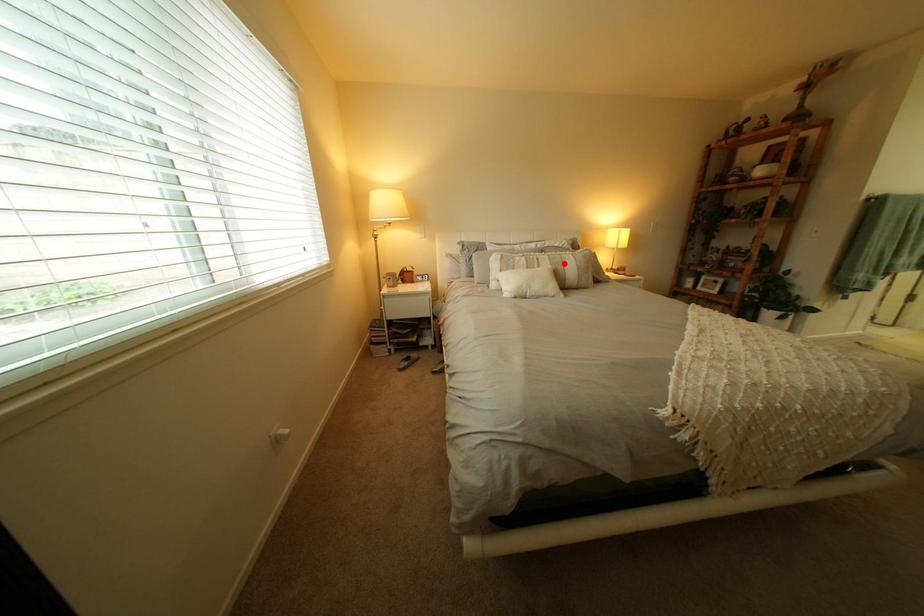
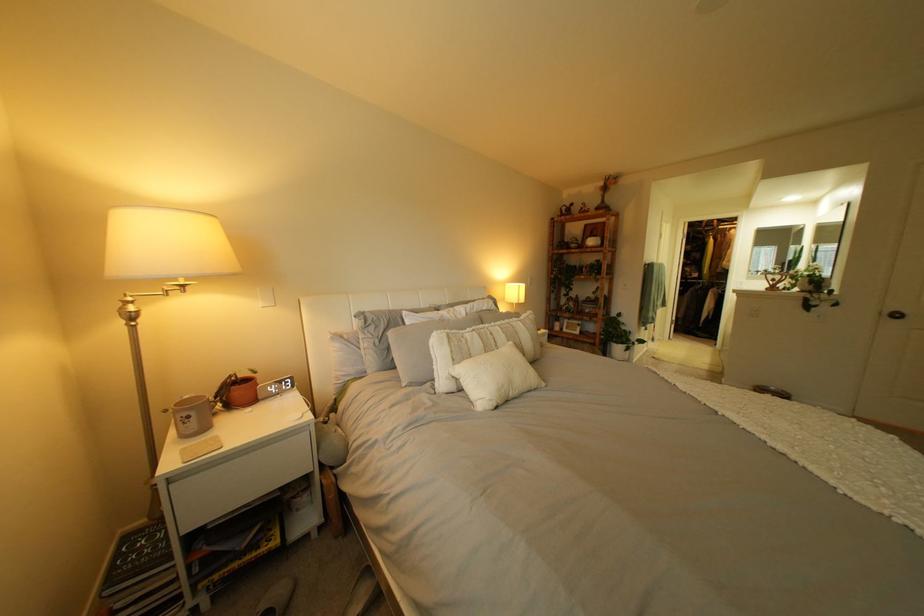
The point at the highlighted location is marked in the first image. Where is the corresponding point in the second image?

(518, 337)